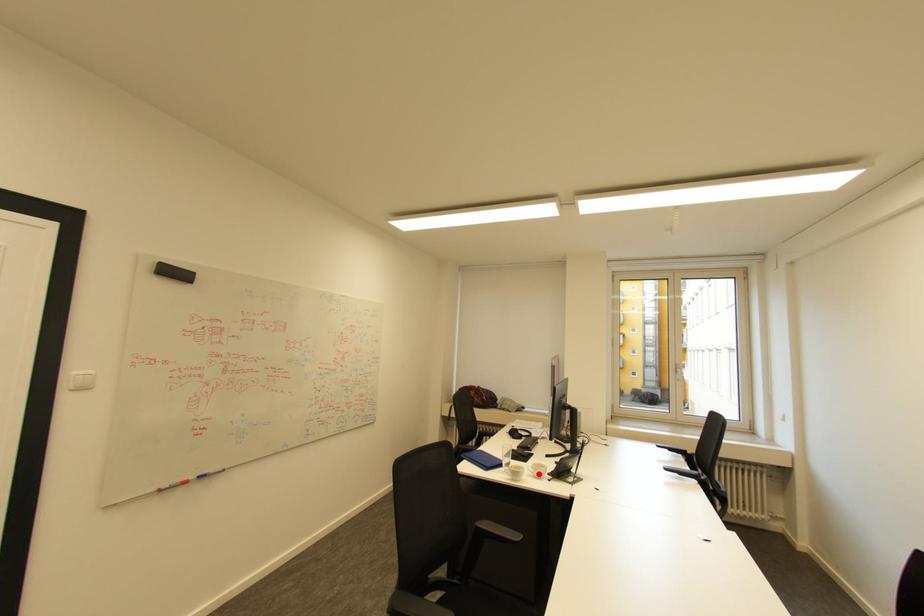
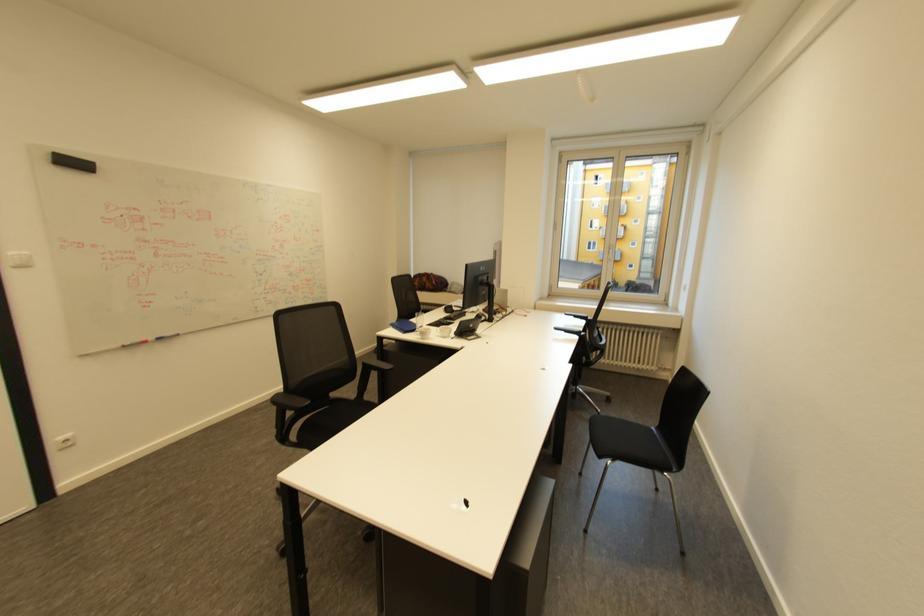
The point at the highlighted location is marked in the first image. Where is the corresponding point in the second image?

(446, 334)